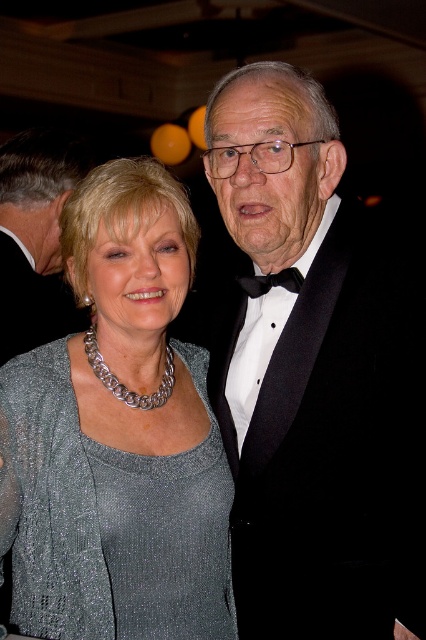
You are a photographer adjusting the focus on your camera. You need to ensure that both the black satin bow tie at upper right and the silver chain necklace at center are in focus. Which object should you focus on first to ensure both are sharp?

You should focus on the silver chain necklace at center first because the black satin bow tie at upper right is positioned over it, so focusing on the closer object will help both be in focus.

You are a photographer at a formal event and need to ensure both the sparkly silver dress at center and the silver chain necklace at center are visible in your photo. Given their sizes, which one might require more careful framing to ensure it doesn not get lost in the image?

The silver chain necklace at center is smaller in size compared to the sparkly silver dress at center, so it might require more careful framing to ensure it doesn not get lost in the image.

You are a photographer setting up for a formal event. You need to ensure that the two black satin bow ties are at least 36 inches apart for the best lighting setup. Based on the image description, will the current placement of the black satin bow tie at upper right and the black satin bow tie at center meet your requirement?

The black satin bow tie at upper right and the black satin bow tie at center are 37.62 inches apart, which is more than the required 36 inches. Therefore, the current placement meets the requirement.